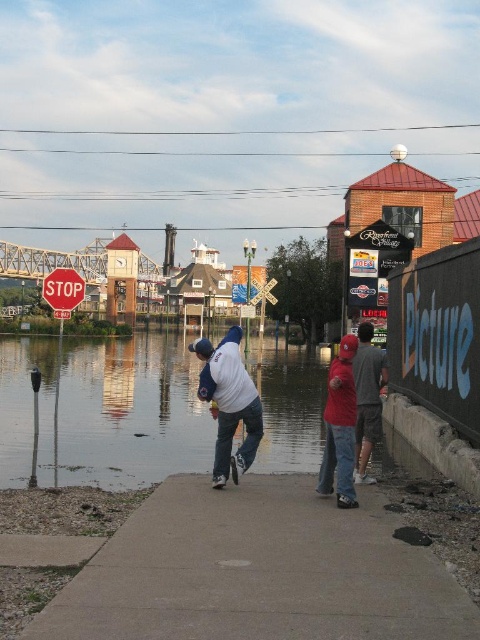
You are standing at the flooded waterfront area and need to reach the wall with graffiti. The concrete sidewalk at lower left is in your way. Can you walk around it? Please provide the coordinates of the sidewalk to plan your path.

The concrete sidewalk at lower left is located at coordinates point (257,572). Since the sidewalk is at lower left, you can walk around it by moving towards the right side of the sidewalk to reach the wall with graffiti.